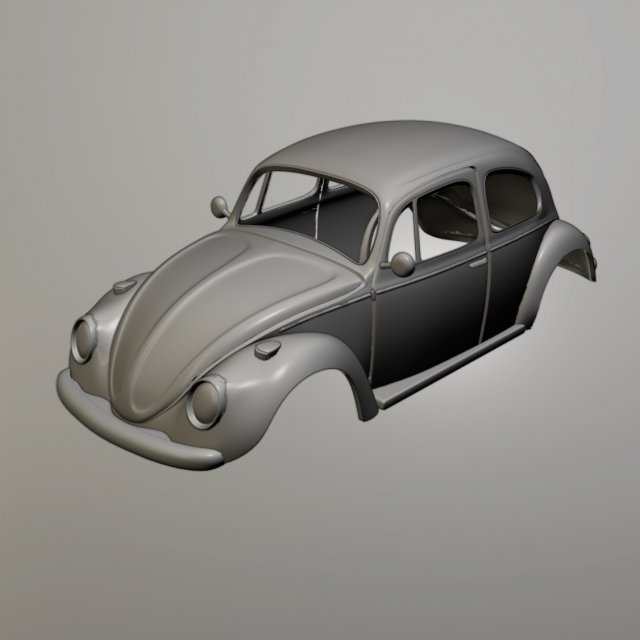
The width and height of the screenshot is (640, 640). I want to click on door, so click(x=443, y=333).